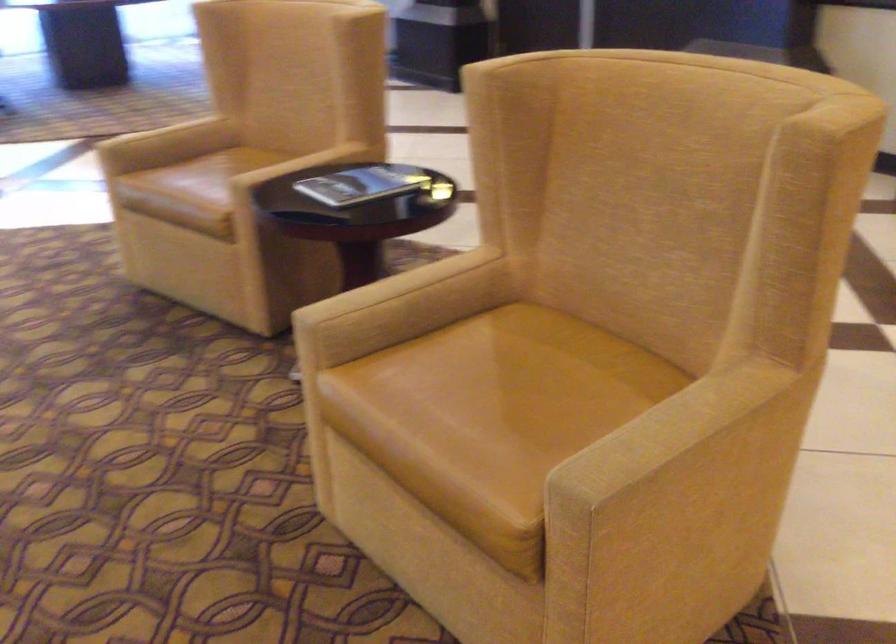
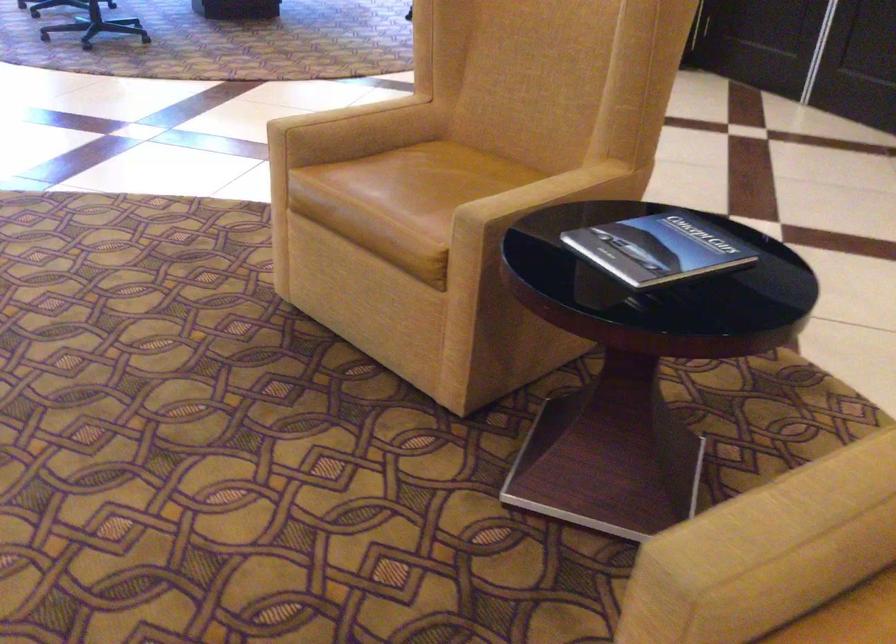
Where in the second image is the point corresponding to point (234, 164) from the first image?

(440, 174)